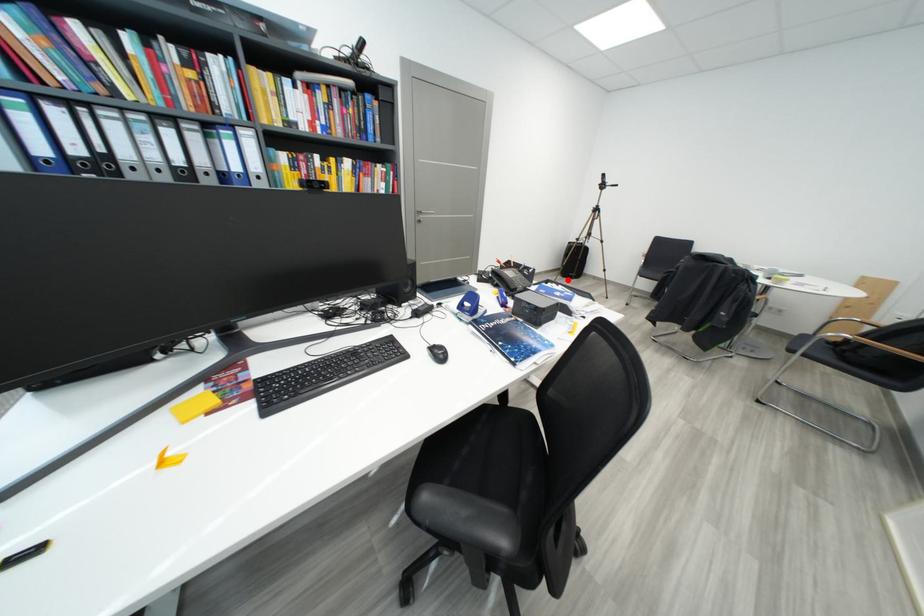
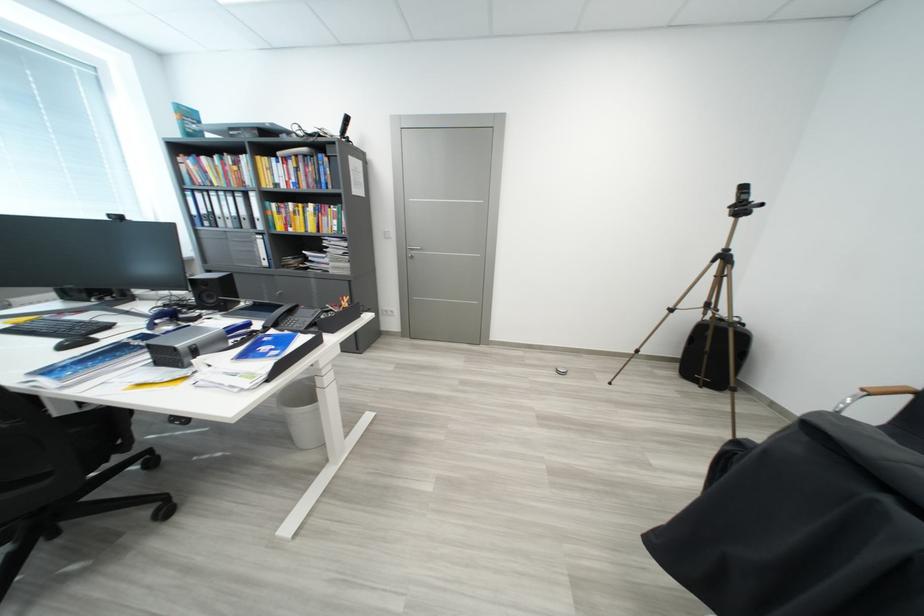
Find the pixel in the second image that matches the highlighted location in the first image.

(684, 377)